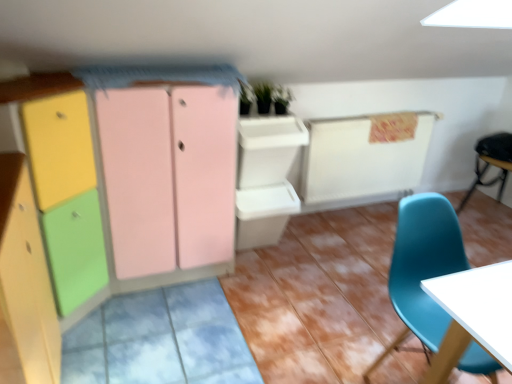
Where is `matte wood cabinet at left, marked as the third cabinetry in a back-to-front arrangement`? Image resolution: width=512 pixels, height=384 pixels. matte wood cabinet at left, marked as the third cabinetry in a back-to-front arrangement is located at coordinates 26,276.

In order to face matte plastic dresser at center, should I rotate leftwards or rightwards?

Rotate left and turn 18.316 degrees.

In order to click on black leather chair at right, which is the second chair in left-to-right order in this screenshot , I will do `click(490, 163)`.

You are a GUI agent. You are given a task and a screenshot of the screen. Output one action in this format:
    pyautogui.click(x=<x>, y=<y>)
    Task: Click on the teal plastic chair at lower right, positioned as the first chair in left-to-right order
    Image resolution: width=512 pixels, height=384 pixels.
    Given the screenshot: What is the action you would take?
    pyautogui.click(x=422, y=268)

This screenshot has height=384, width=512. What do you see at coordinates (281, 99) in the screenshot? I see `green matte plant at upper center` at bounding box center [281, 99].

Locate an element on the screen. This screenshot has height=384, width=512. matte pink cabinet at center, which is the third cabinetry from front to back is located at coordinates [169, 176].

Would you say matte pink cabinet at center, which is the 1th cabinetry from back to front, is inside or outside green matte plant at upper center?

matte pink cabinet at center, which is the 1th cabinetry from back to front, lies outside green matte plant at upper center.

In the image, is matte pink cabinet at center, which is the 1th cabinetry from back to front, positioned in front of or behind green matte plant at upper center?

matte pink cabinet at center, which is the 1th cabinetry from back to front, is positioned closer to the viewer than green matte plant at upper center.

Can you confirm if matte pink cabinet at center, which is the 1th cabinetry from back to front, is thinner than green matte plant at upper center?

Incorrect, the width of matte pink cabinet at center, which is the 1th cabinetry from back to front, is not less than that of green matte plant at upper center.

Which is correct: green matte plant at upper center is inside black leather chair at right, the second chair viewed from the front, or outside of it?

green matte plant at upper center cannot be found inside black leather chair at right, the second chair viewed from the front.

Looking at this image, from the image's perspective, is green matte plant at upper center located above or below black leather chair at right, which is the second chair in left-to-right order?

green matte plant at upper center is situated higher than black leather chair at right, which is the second chair in left-to-right order, in the image.

Is matte wood cabinet at left, the first cabinetry in the front-to-back sequence, far away from matte wood cabinet at left, placed as the second cabinetry when sorted from front to back?

No.

Which object is positioned more to the right, matte wood cabinet at left, marked as the third cabinetry in a back-to-front arrangement, or matte wood cabinet at left, the second cabinetry when ordered from back to front?

From the viewer's perspective, matte wood cabinet at left, marked as the third cabinetry in a back-to-front arrangement, appears more on the right side.

Considering the sizes of matte wood cabinet at left, the first cabinetry in the front-to-back sequence, and matte wood cabinet at left, placed as the second cabinetry when sorted from front to back, in the image, is matte wood cabinet at left, the first cabinetry in the front-to-back sequence, taller or shorter than matte wood cabinet at left, placed as the second cabinetry when sorted from front to back,?

matte wood cabinet at left, the first cabinetry in the front-to-back sequence, is shorter than matte wood cabinet at left, placed as the second cabinetry when sorted from front to back.

Is the depth of matte wood cabinet at left, the first cabinetry in the front-to-back sequence, less than that of matte wood cabinet at left, placed as the second cabinetry when sorted from front to back?

Yes, it is in front of matte wood cabinet at left, placed as the second cabinetry when sorted from front to back.

From a real-world perspective, is matte pink cabinet at center, which is the 1th cabinetry from back to front, beneath matte wood cabinet at left, the first cabinetry in the front-to-back sequence?

Incorrect, from a real-world perspective, matte pink cabinet at center, which is the 1th cabinetry from back to front, is higher than matte wood cabinet at left, the first cabinetry in the front-to-back sequence.

From the picture: Does matte pink cabinet at center, which is the 1th cabinetry from back to front, turn towards matte wood cabinet at left, the first cabinetry in the front-to-back sequence?

No.

From the image's perspective, is matte pink cabinet at center, which is the third cabinetry from front to back, above matte wood cabinet at left, the first cabinetry in the front-to-back sequence?

Yes.

From the image's perspective, is black leather chair at right, which is the first chair from top to bottom, located above or below matte plastic dresser at center?

Clearly, from the image's perspective, black leather chair at right, which is the first chair from top to bottom, is above matte plastic dresser at center.

In terms of height, does black leather chair at right, which is the first chair from top to bottom, look taller or shorter compared to matte plastic dresser at center?

Clearly, black leather chair at right, which is the first chair from top to bottom, is shorter compared to matte plastic dresser at center.

Which object is positioned more to the right, black leather chair at right, which is the first chair from top to bottom, or matte plastic dresser at center?

Positioned to the right is black leather chair at right, which is the first chair from top to bottom.

Is black leather chair at right, which is the first chair from top to bottom, not within matte plastic dresser at center?

Yes, black leather chair at right, which is the first chair from top to bottom, is not within matte plastic dresser at center.

Is matte plastic dresser at center in front of teal plastic chair at lower right, marked as the 2th chair in a top-to-bottom arrangement?

Yes, matte plastic dresser at center is in front of teal plastic chair at lower right, marked as the 2th chair in a top-to-bottom arrangement.

Consider the image. Is matte plastic dresser at center directly adjacent to teal plastic chair at lower right, positioned as the first chair in left-to-right order?

No.

Consider the image. Choose the correct answer: Is matte plastic dresser at center inside teal plastic chair at lower right, which ranks as the 2th chair in right-to-left order, or outside it?

matte plastic dresser at center is spatially situated outside teal plastic chair at lower right, which ranks as the 2th chair in right-to-left order.

From a real-world perspective, starting from the matte pink cabinet at center, which is the third cabinetry from front to back, which chair is the 1st one below it? Please provide its 2D coordinates.

[(490, 163)]

Could you tell me if black leather chair at right, the first chair in the right-to-left sequence, is facing matte pink cabinet at center, which is the third cabinetry from front to back?

Yes, black leather chair at right, the first chair in the right-to-left sequence, is turned towards matte pink cabinet at center, which is the third cabinetry from front to back.

Considering the relative sizes of black leather chair at right, which is the second chair in left-to-right order, and matte pink cabinet at center, which is the third cabinetry from front to back, in the image provided, is black leather chair at right, which is the second chair in left-to-right order, smaller than matte pink cabinet at center, which is the third cabinetry from front to back,?

Yes.

Where is `plant on the right of matte pink cabinet at center, which is the 1th cabinetry from back to front`? The width and height of the screenshot is (512, 384). plant on the right of matte pink cabinet at center, which is the 1th cabinetry from back to front is located at coordinates (281, 99).

Identify the location of chair behind the green matte plant at upper center. This screenshot has width=512, height=384. (490, 163).

Based on their spatial positions, is matte wood cabinet at left, marked as the third cabinetry in a back-to-front arrangement, or teal plastic chair at lower right, marked as the 2th chair in a top-to-bottom arrangement, closer to green matte plant at upper center?

teal plastic chair at lower right, marked as the 2th chair in a top-to-bottom arrangement, is positioned closer to the anchor green matte plant at upper center.

Which object lies nearer to the anchor point matte wood cabinet at left, the second cabinetry when ordered from back to front, teal plastic chair at lower right, the first chair from the front, or black leather chair at right, which is the first chair from top to bottom?

teal plastic chair at lower right, the first chair from the front, is positioned closer to the anchor matte wood cabinet at left, the second cabinetry when ordered from back to front.

Based on their spatial positions, is matte wood cabinet at left, placed as the second cabinetry when sorted from front to back, or matte plastic dresser at center closer to matte wood cabinet at left, the first cabinetry in the front-to-back sequence?

matte plastic dresser at center lies closer to matte wood cabinet at left, the first cabinetry in the front-to-back sequence, than the other object.

From the image, which object appears to be farther from matte plastic dresser at center, green matte plant at upper center or matte wood cabinet at left, placed as the second cabinetry when sorted from front to back?

green matte plant at upper center is positioned further to the anchor matte plastic dresser at center.

From the picture: Estimate the real-world distances between objects in this image. Which object is further from matte wood cabinet at left, the second cabinetry when ordered from back to front, black leather chair at right, which is the second chair in left-to-right order, or matte plastic dresser at center?

Based on the image, black leather chair at right, which is the second chair in left-to-right order, appears to be further to matte wood cabinet at left, the second cabinetry when ordered from back to front.

When comparing their distances from matte pink cabinet at center, which is the 1th cabinetry from back to front, does matte wood cabinet at left, placed as the second cabinetry when sorted from front to back, or black leather chair at right, which is the first chair from top to bottom, seem closer?

matte wood cabinet at left, placed as the second cabinetry when sorted from front to back.

From the image, which object appears to be nearer to matte wood cabinet at left, marked as the third cabinetry in a back-to-front arrangement, matte pink cabinet at center, which is the 1th cabinetry from back to front, or black leather chair at right, the second chair viewed from the front?

matte pink cabinet at center, which is the 1th cabinetry from back to front, is positioned closer to the anchor matte wood cabinet at left, marked as the third cabinetry in a back-to-front arrangement.

In the scene shown: From the image, which object appears to be farther from matte pink cabinet at center, which is the third cabinetry from front to back, green matte plant at upper center or matte plastic dresser at center?

Among the two, green matte plant at upper center is located further to matte pink cabinet at center, which is the third cabinetry from front to back.

Where is `cabinetry located between matte wood cabinet at left, marked as the third cabinetry in a back-to-front arrangement, and teal plastic chair at lower right, placed as the first chair when sorted from bottom to top, in the left-right direction`? The height and width of the screenshot is (384, 512). cabinetry located between matte wood cabinet at left, marked as the third cabinetry in a back-to-front arrangement, and teal plastic chair at lower right, placed as the first chair when sorted from bottom to top, in the left-right direction is located at coordinates (169, 176).

At what (x,y) coordinates should I click in order to perform the action: click on chair between matte wood cabinet at left, the second cabinetry when ordered from back to front, and black leather chair at right, which appears as the 2th chair when ordered from the bottom, from left to right. Please return your answer as a coordinate pair (x, y). The image size is (512, 384). Looking at the image, I should click on (422, 268).

This screenshot has width=512, height=384. Identify the location of chair located between matte plastic dresser at center and black leather chair at right, positioned as the 1th chair in back-to-front order, in the left-right direction. (422, 268).

The height and width of the screenshot is (384, 512). I want to click on cabinetry positioned between matte plastic dresser at center and matte wood cabinet at left, the second cabinetry when ordered from back to front, from near to far, so click(26, 276).